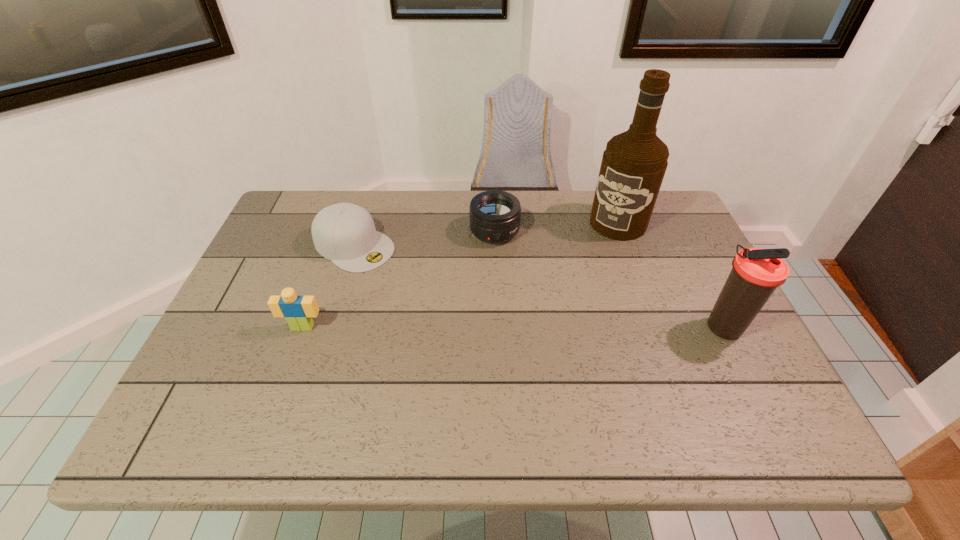
In the image, there is a desktop. At what (x,y) coordinates should I click in order to perform the action: click on free space at the right edge. Please return your answer as a coordinate pair (x, y). The width and height of the screenshot is (960, 540). Looking at the image, I should click on pyautogui.click(x=706, y=316).

This screenshot has height=540, width=960. In order to click on free space at the far left corner of the desktop in this screenshot , I will do `click(338, 200)`.

Image resolution: width=960 pixels, height=540 pixels. In order to click on vacant point at the far right corner in this screenshot , I will do `click(660, 213)`.

Where is `free space between the cap and the third object from right to left`? free space between the cap and the third object from right to left is located at coordinates (424, 239).

Identify the location of free space between the Lego and the cap. The width and height of the screenshot is (960, 540). (328, 286).

Where is `free space between the Lego and the third object from right to left`? The image size is (960, 540). free space between the Lego and the third object from right to left is located at coordinates (398, 279).

Locate an element on the screen. vacant area between the alcohol and the third tallest object is located at coordinates click(461, 275).

I want to click on blank region between the cap and the second tallest object, so click(539, 286).

I want to click on empty location between the rightmost object and the cap, so click(x=539, y=286).

Locate an element on the screen. This screenshot has height=540, width=960. empty location between the second object from right to left and the third tallest object is located at coordinates (461, 275).